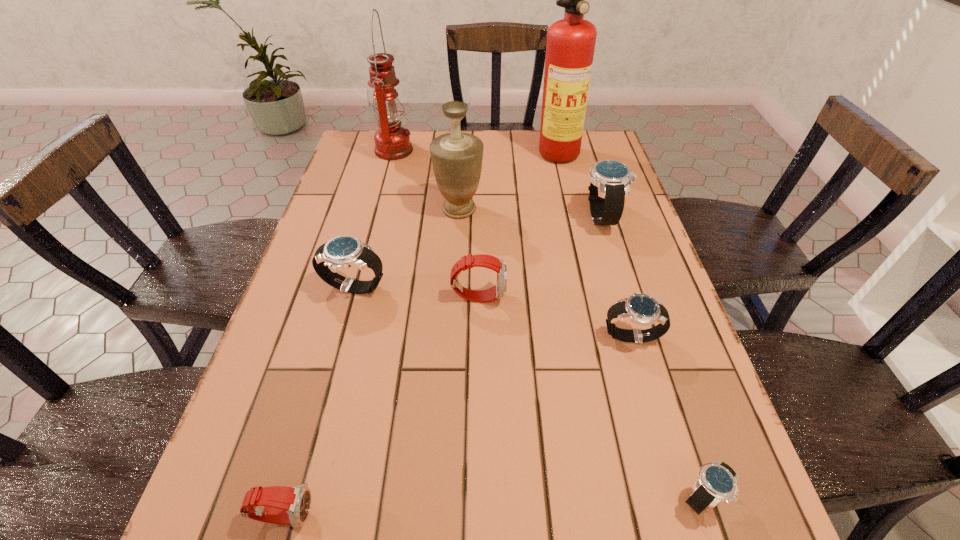
Image resolution: width=960 pixels, height=540 pixels. What are the coordinates of `free space between the urn and the second smallest silver watch` in the screenshot? It's located at (545, 272).

Where is `vacant region between the farther red watch and the red fire extinguisher`? The image size is (960, 540). vacant region between the farther red watch and the red fire extinguisher is located at coordinates (522, 225).

The image size is (960, 540). In order to click on vacant area that lies between the biggest silver watch and the bigger red watch in this screenshot , I will do `click(540, 256)`.

At what (x,y) coordinates should I click in order to perform the action: click on vacant area between the shortest object and the third tallest object. Please return your answer as a coordinate pair (x, y). Looking at the image, I should click on (581, 353).

You are a GUI agent. You are given a task and a screenshot of the screen. Output one action in this format:
    pyautogui.click(x=<x>, y=<y>)
    Task: Click on the free spot between the right red watch and the smaller red watch
    The height and width of the screenshot is (540, 960).
    Given the screenshot: What is the action you would take?
    pyautogui.click(x=381, y=405)

Where is `free spot between the nearest silver watch and the red oil lamp`? The image size is (960, 540). free spot between the nearest silver watch and the red oil lamp is located at coordinates (547, 324).

Image resolution: width=960 pixels, height=540 pixels. I want to click on vacant space that is in between the fire extinguisher and the biggest silver watch, so click(x=584, y=185).

Locate an element on the screen. vacant area that lies between the third tallest object and the fourth watch from right to left is located at coordinates (468, 253).

This screenshot has height=540, width=960. Identify the location of object that is the third nearest to the seventh farthest object. (610, 180).

This screenshot has height=540, width=960. I want to click on object that stands as the closest to the shortest object, so click(x=642, y=309).